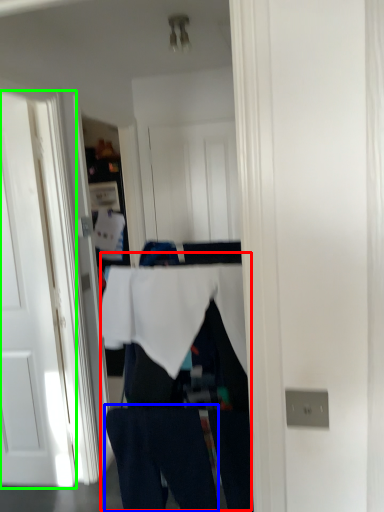
Question: Which is nearer to the person (highlighted by a red box)? jeans (highlighted by a blue box) or door (highlighted by a green box).

Choices:
 (A) jeans
 (B) door

Answer: (A)